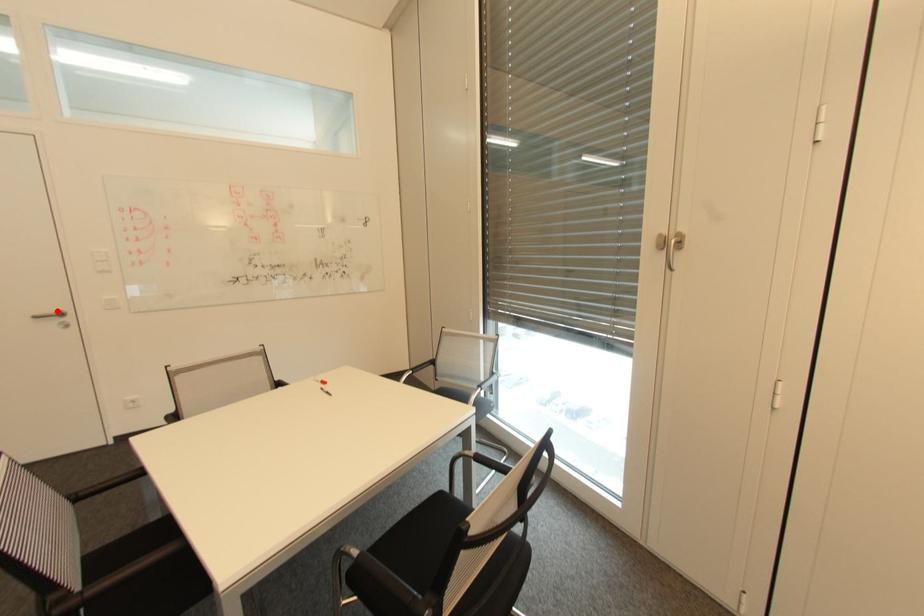
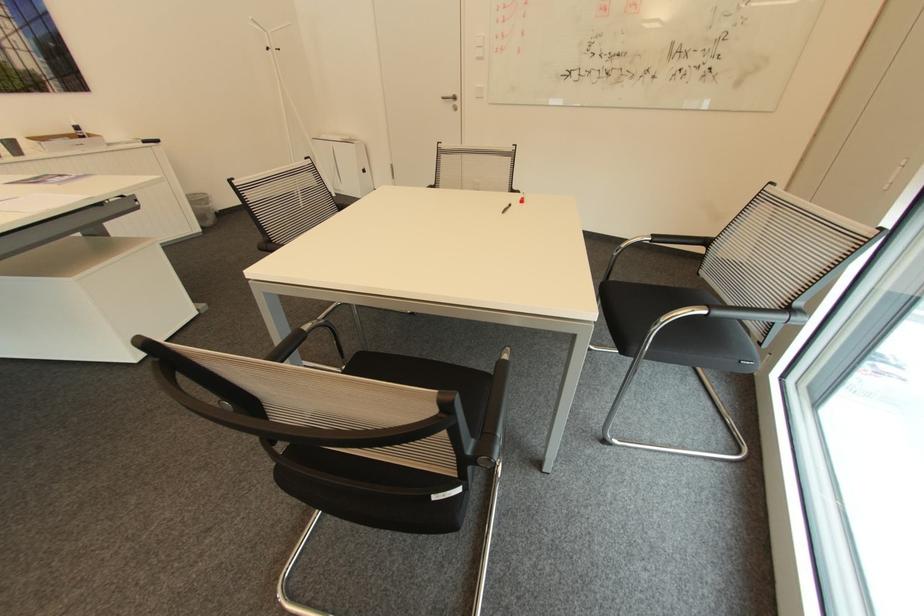
Where in the second image is the point corresponding to the highlighted location from the first image?

(456, 95)